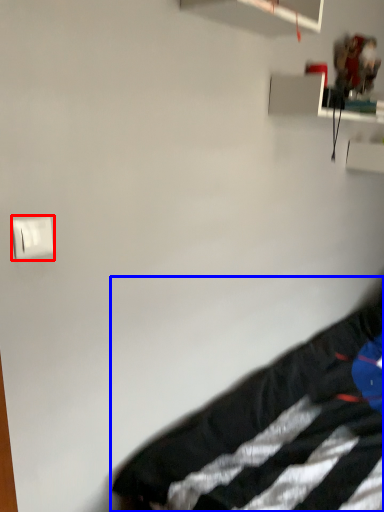
Question: Which object appears farthest to the camera in this image, light switch (highlighted by a red box) or furniture (highlighted by a blue box)?

Choices:
 (A) light switch
 (B) furniture

Answer: (A)